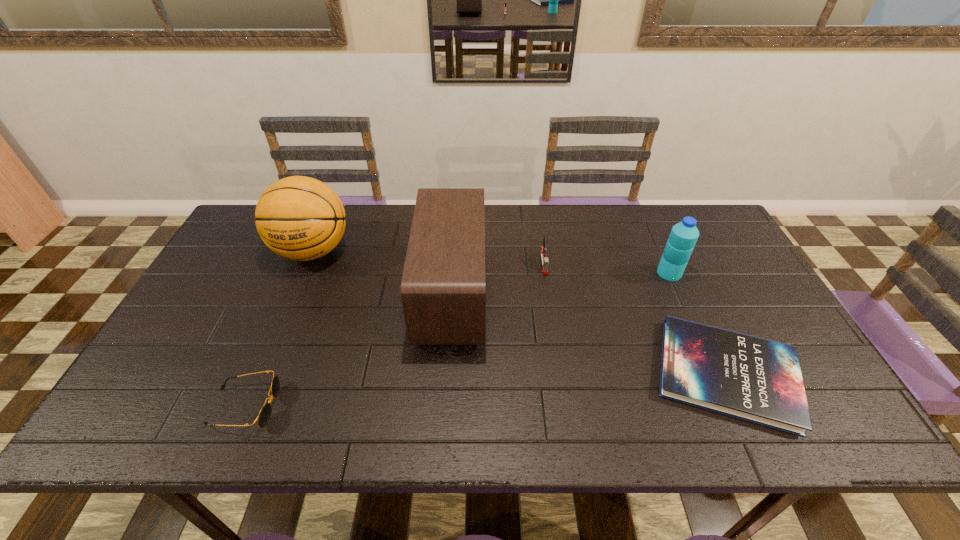
Where is `vacant space that satisfies the following two spatial constraints: 1. on the surface of the basketball near the brand logo; 2. on the front-facing side of the second shortest object`? The width and height of the screenshot is (960, 540). vacant space that satisfies the following two spatial constraints: 1. on the surface of the basketball near the brand logo; 2. on the front-facing side of the second shortest object is located at coordinates (248, 407).

You are a GUI agent. You are given a task and a screenshot of the screen. Output one action in this format:
    pyautogui.click(x=<x>, y=<y>)
    Task: Click on the free space that satisfies the following two spatial constraints: 1. on the surface of the basketball near the brand logo; 2. on the right side of the shortest object
    The image size is (960, 540).
    Given the screenshot: What is the action you would take?
    pyautogui.click(x=261, y=374)